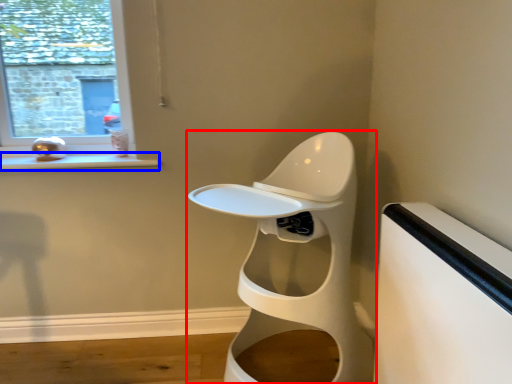
Question: Which object appears farthest to the camera in this image, toilet (highlighted by a red box) or window sill (highlighted by a blue box)?

Choices:
 (A) toilet
 (B) window sill

Answer: (B)